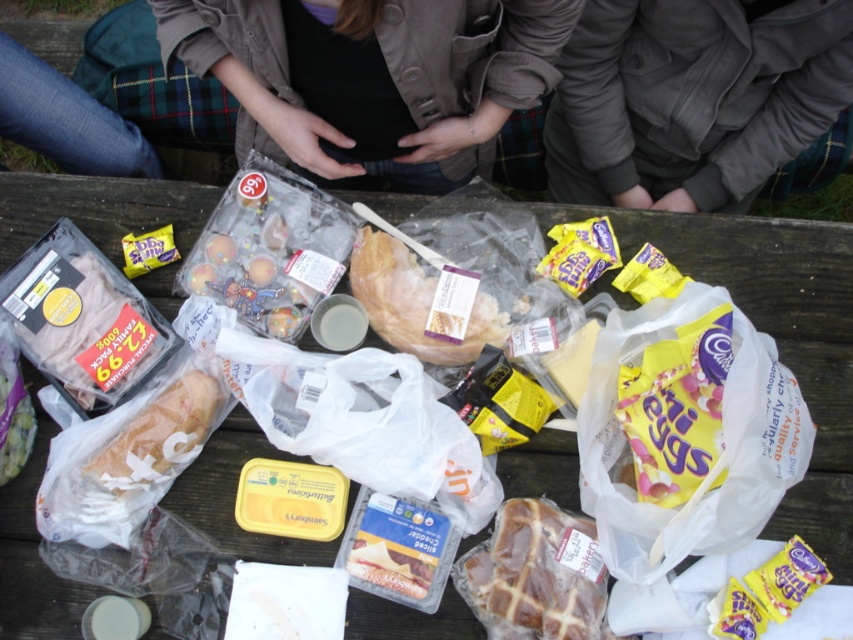
Does gray fabric jacket at upper center have a greater height compared to yellow foil chocolate at lower right?

Yes.

Does gray fabric jacket at upper center have a larger size compared to yellow foil chocolate at lower right?

Indeed, gray fabric jacket at upper center has a larger size compared to yellow foil chocolate at lower right.

Does point (722, 115) come in front of point (793, 595)?

No, it is not.

Locate an element on the screen. The image size is (853, 640). gray fabric jacket at upper center is located at coordinates (693, 99).

The width and height of the screenshot is (853, 640). What do you see at coordinates (784, 340) in the screenshot? I see `wooden picnic table at center` at bounding box center [784, 340].

Is wooden picnic table at center bigger than matte brown bread at center?

Indeed, wooden picnic table at center has a larger size compared to matte brown bread at center.

Is point (28, 624) more distant than point (422, 272)?

No, it is not.

You are a GUI agent. You are given a task and a screenshot of the screen. Output one action in this format:
    pyautogui.click(x=<x>, y=<y>)
    Task: Click on the wooden picnic table at center
    
    Given the screenshot: What is the action you would take?
    pyautogui.click(x=784, y=340)

Is golden brown glazed hot cross bun at center positioned before white bread at center?

Yes.

Does point (589, 609) come farther from viewer compared to point (202, 426)?

No, it is in front of (202, 426).

Between point (566, 529) and point (202, 424), which one is positioned in front?

Point (566, 529) is more forward.

Locate an element on the screen. The height and width of the screenshot is (640, 853). golden brown glazed hot cross bun at center is located at coordinates (535, 573).